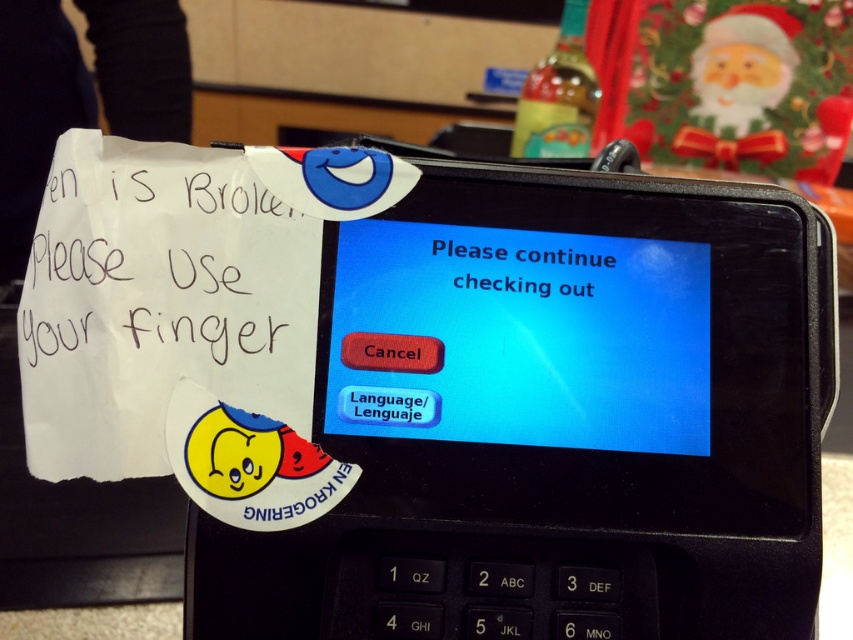
Question: Is white paper at left to the right of yellow paper sticker at lower left from the viewer's perspective?

Choices:
 (A) no
 (B) yes

Answer: (A)

Question: Among these objects, which one is farthest from the camera?

Choices:
 (A) yellow paper sticker at lower left
 (B) white paper at left
 (C) black plastic phone at center
 (D) blue glossy text at center

Answer: (D)

Question: Which object appears farthest from the camera in this image?

Choices:
 (A) blue glossy text at center
 (B) black plastic phone at center
 (C) yellow paper sticker at lower left
 (D) white paper at left

Answer: (A)

Question: Where is black plastic phone at center located in relation to white paper at left in the image?

Choices:
 (A) above
 (B) below

Answer: (B)

Question: Which object is the closest to the blue glossy text at center?

Choices:
 (A) yellow paper sticker at lower left
 (B) black plastic phone at center

Answer: (B)

Question: From the image, what is the correct spatial relationship of white paper at left in relation to yellow paper sticker at lower left?

Choices:
 (A) above
 (B) below

Answer: (A)